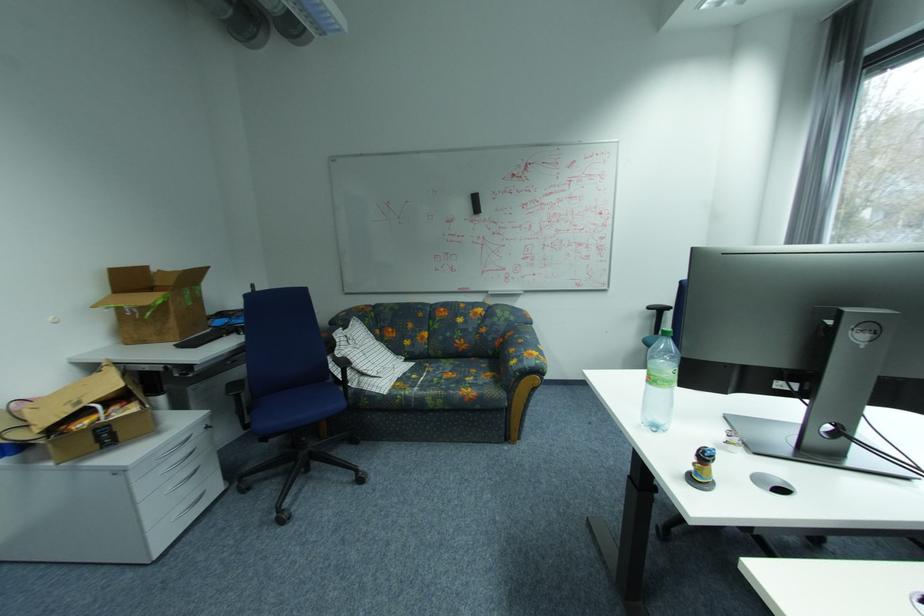
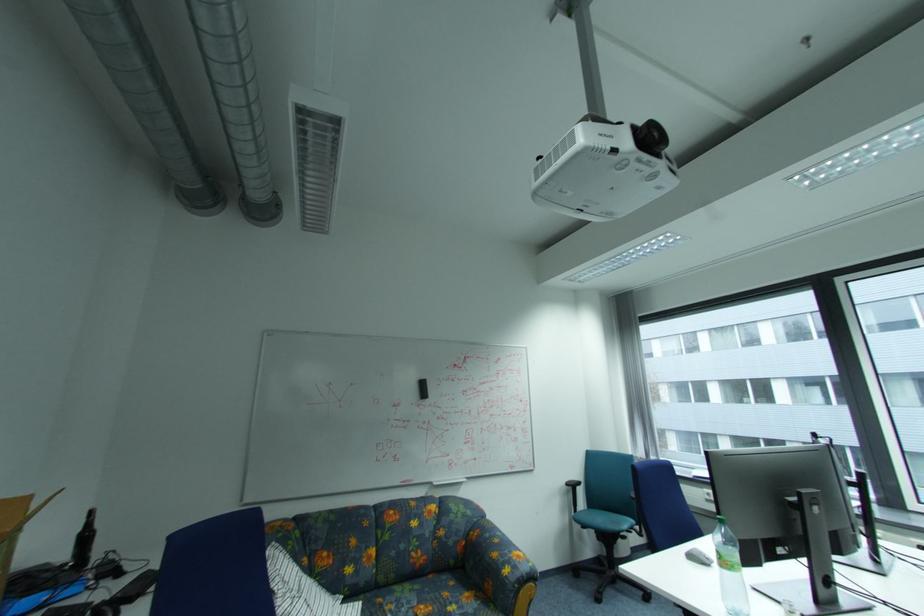
Where in the second image is the point corresponding to (521,363) from the first image?

(515, 572)